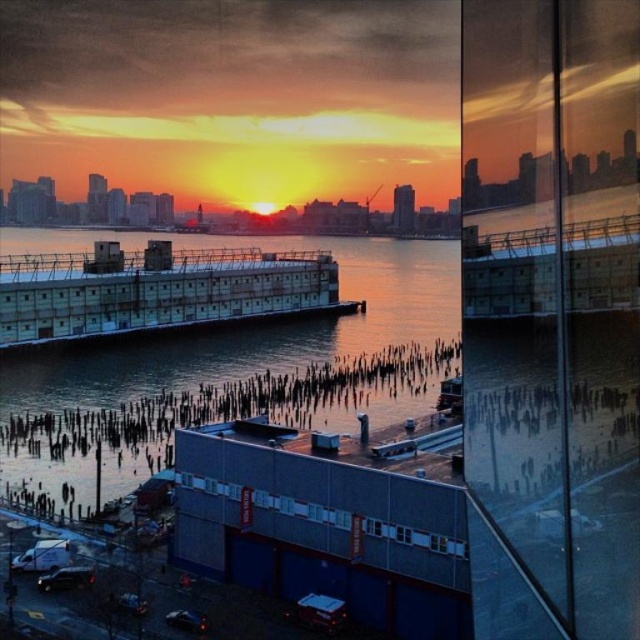
You are an architect reviewing this cityscape design. You notice the reflective glass water at center and the blue matte building at center. According to the design, which object is positioned higher in the visual hierarchy?

The reflective glass water at center is located above the blue matte building at center, making it higher in the visual hierarchy.

You are standing at the edge of the body of water in the cityscape and want to walk towards the distant horizon. Which of the two points, point (305, 248) or point (317, 506), is closer to you as you face the horizon?

Point (305, 248) is closer to you because it is further to the viewer than point (317, 506), meaning it is nearer in the scene.